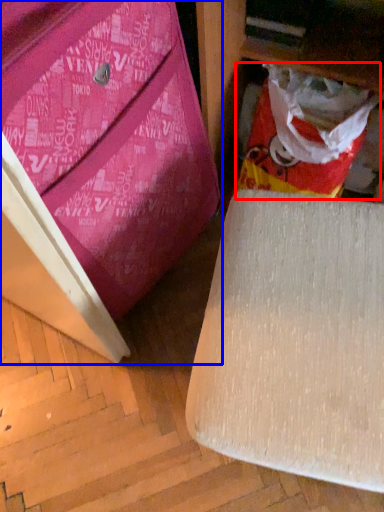
Question: Among these objects, which one is farthest to the camera, shopping bag (highlighted by a red box) or furniture (highlighted by a blue box)?

Choices:
 (A) shopping bag
 (B) furniture

Answer: (A)